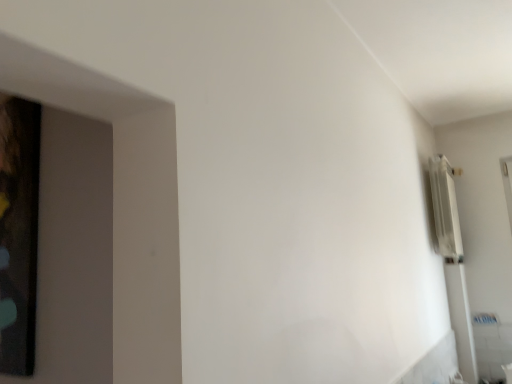
Question: Is white metallic radiator at upper right bigger than wooden picture frame at left?

Choices:
 (A) yes
 (B) no

Answer: (A)

Question: Could you tell me if white metallic radiator at upper right is facing wooden picture frame at left?

Choices:
 (A) yes
 (B) no

Answer: (B)

Question: Can you confirm if white metallic radiator at upper right is positioned to the left of wooden picture frame at left?

Choices:
 (A) yes
 (B) no

Answer: (B)

Question: From a real-world perspective, does white metallic radiator at upper right stand above wooden picture frame at left?

Choices:
 (A) no
 (B) yes

Answer: (B)

Question: Is white metallic radiator at upper right at the right side of wooden picture frame at left?

Choices:
 (A) no
 (B) yes

Answer: (B)

Question: From the image's perspective, does white metallic radiator at upper right appear lower than wooden picture frame at left?

Choices:
 (A) yes
 (B) no

Answer: (A)

Question: From a real-world perspective, is wooden picture frame at left over white metallic radiator at upper right?

Choices:
 (A) yes
 (B) no

Answer: (B)

Question: Is the depth of wooden picture frame at left greater than that of white metallic radiator at upper right?

Choices:
 (A) no
 (B) yes

Answer: (A)

Question: Does wooden picture frame at left have a larger size compared to white metallic radiator at upper right?

Choices:
 (A) yes
 (B) no

Answer: (B)

Question: Does wooden picture frame at left have a greater height compared to white metallic radiator at upper right?

Choices:
 (A) yes
 (B) no

Answer: (A)

Question: Is wooden picture frame at left thinner than white metallic radiator at upper right?

Choices:
 (A) yes
 (B) no

Answer: (A)

Question: From the image's perspective, is wooden picture frame at left located above white metallic radiator at upper right?

Choices:
 (A) yes
 (B) no

Answer: (A)

Question: From a real-world perspective, is white metallic radiator at upper right above or below wooden picture frame at left?

Choices:
 (A) above
 (B) below

Answer: (A)